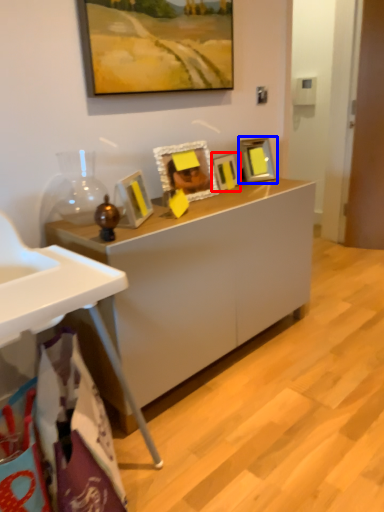
Question: Which of the following is the farthest to the observer, picture frame (highlighted by a red box) or picture frame (highlighted by a blue box)?

Choices:
 (A) picture frame
 (B) picture frame

Answer: (B)